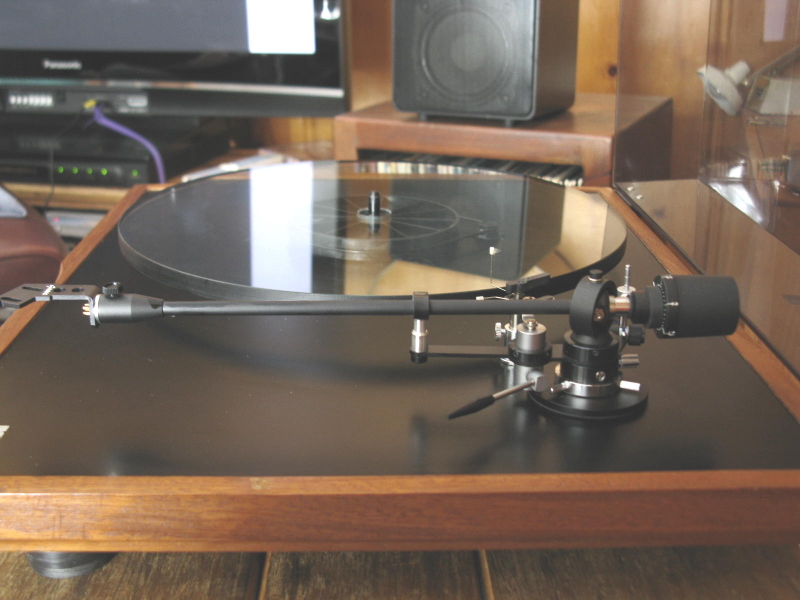
Identify the location of tabletop. (129, 577), (605, 118).